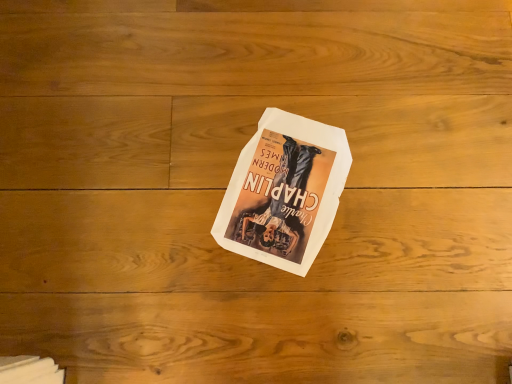
You are a GUI agent. You are given a task and a screenshot of the screen. Output one action in this format:
    pyautogui.click(x=<x>, y=<y>)
    Task: Click on the free spot above white paper at center (from a real-world perspective)
    
    Given the screenshot: What is the action you would take?
    pyautogui.click(x=286, y=184)